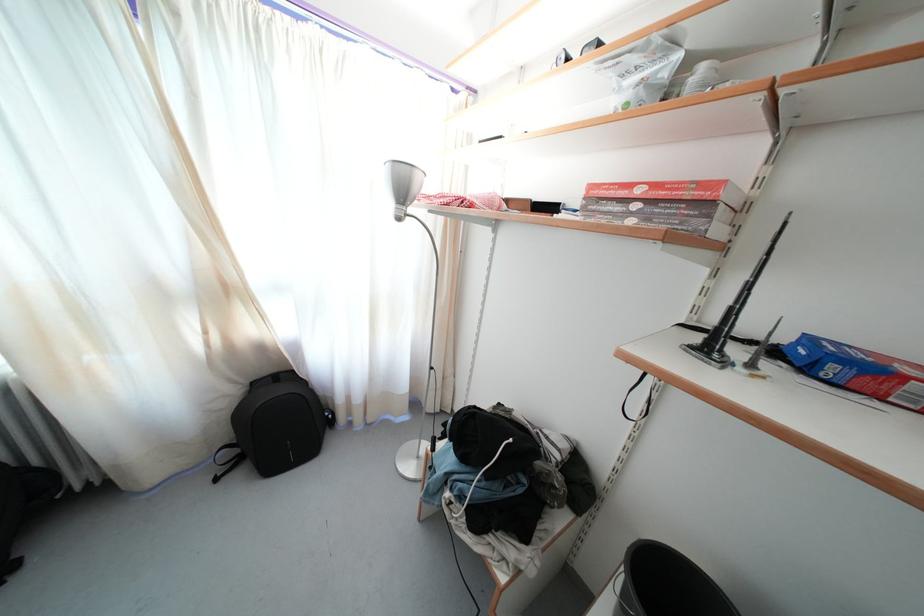
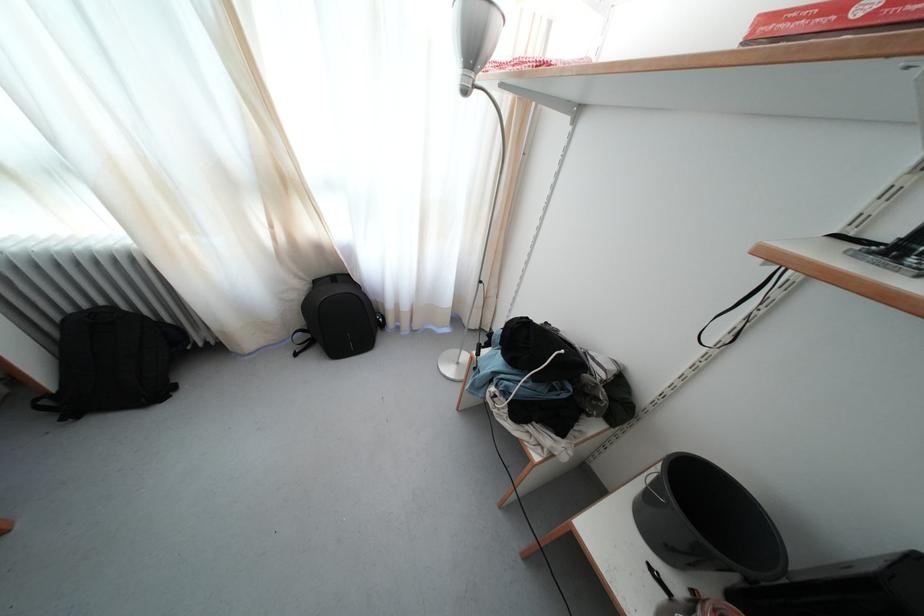
Question: The first image is from the beginning of the video and the second image is from the end. How did the camera likely rotate when shooting the video?

Choices:
 (A) Left
 (B) Right
 (C) Up
 (D) Down

Answer: (D)